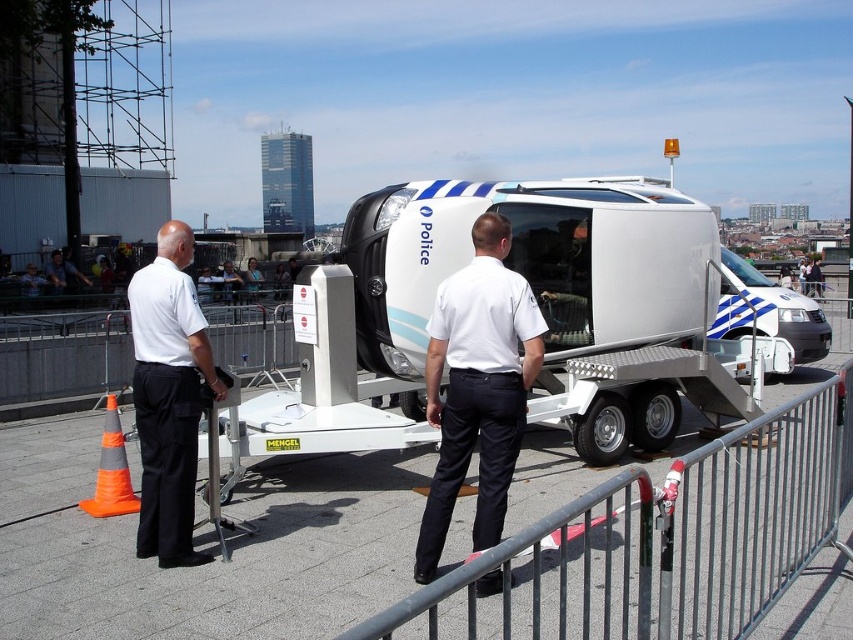
Question: Can you confirm if metal at right is positioned below white glossy van at center?

Choices:
 (A) yes
 (B) no

Answer: (A)

Question: Which object is the farthest from the metal at right?

Choices:
 (A) white glossy van at center
 (B) white uniform at left
 (C) white smooth shirt at center
 (D) white shirt at center

Answer: (D)

Question: Estimate the real-world distances between objects in this image. Which object is closer to the white uniform at left?

Choices:
 (A) white smooth shirt at center
 (B) metal at right
 (C) orange reflective cone at lower left

Answer: (C)

Question: From the image, what is the correct spatial relationship of metal at right in relation to white smooth shirt at center?

Choices:
 (A) right
 (B) left

Answer: (A)

Question: Which of the following is the farthest from the observer?

Choices:
 (A) metal at right
 (B) white glossy van at center

Answer: (B)

Question: Does orange reflective cone at lower left have a larger size compared to white shirt at center?

Choices:
 (A) yes
 (B) no

Answer: (B)